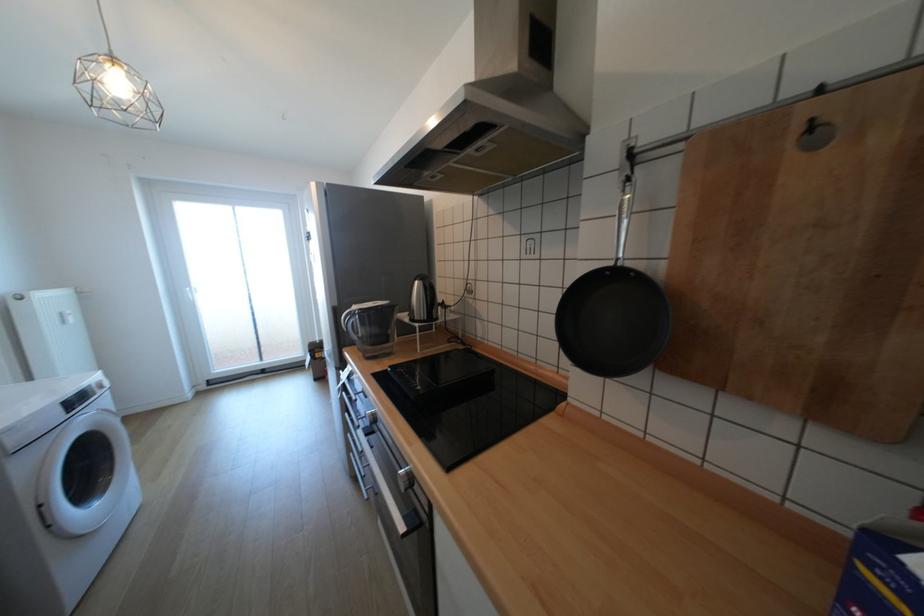
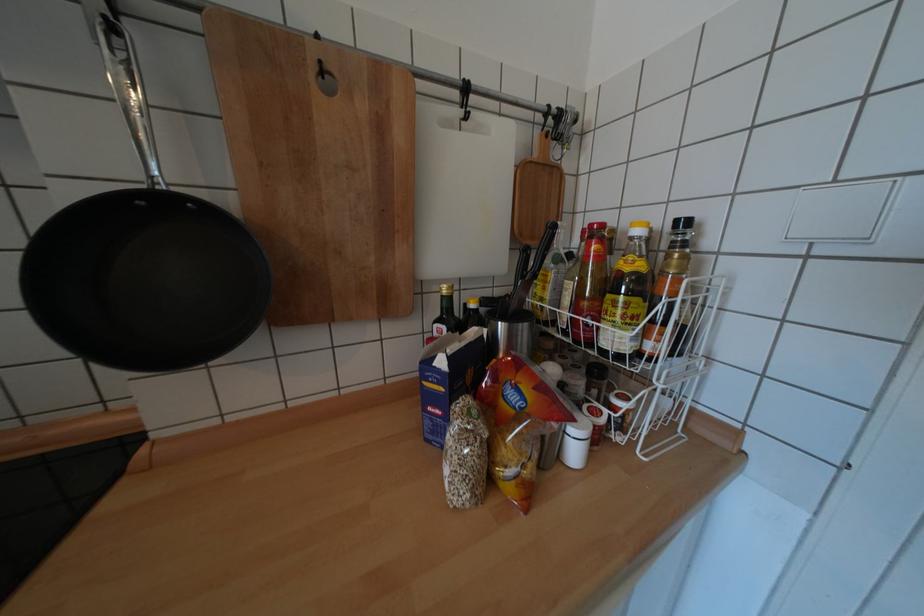
Find the pixel in the second image that matches (x=637, y=176) in the first image.

(115, 18)